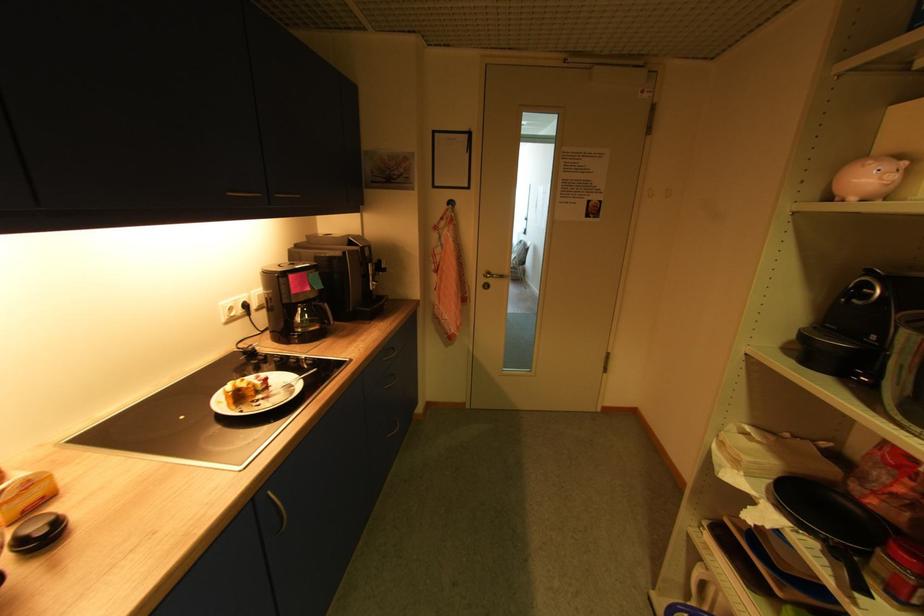
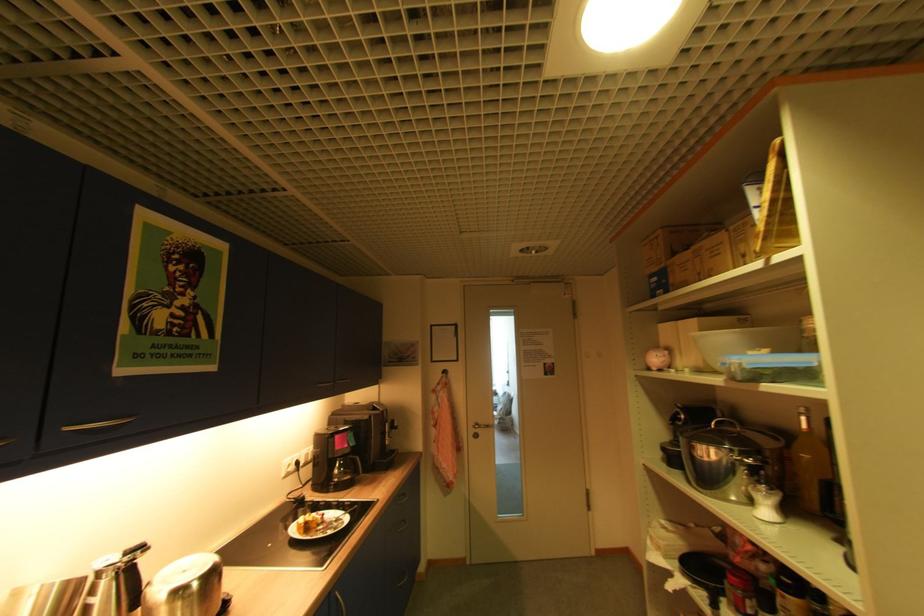
The point at (x=495, y=282) is marked in the first image. Where is the corresponding point in the second image?

(484, 431)